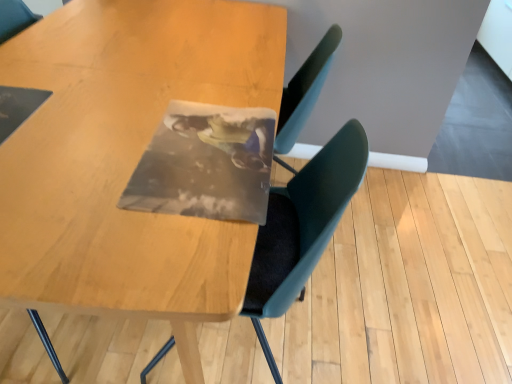
Question: Considering the positions of matte plastic photo frame at center and wooden table at center in the image, is matte plastic photo frame at center bigger or smaller than wooden table at center?

Choices:
 (A) small
 (B) big

Answer: (A)

Question: Do you think matte plastic photo frame at center is within wooden table at center, or outside of it?

Choices:
 (A) outside
 (B) inside

Answer: (B)

Question: Would you say matte plastic photo frame at center is to the left or to the right of wooden table at center in the picture?

Choices:
 (A) left
 (B) right

Answer: (B)

Question: Considering the positions of wooden table at center and matte plastic photo frame at center in the image, is wooden table at center bigger or smaller than matte plastic photo frame at center?

Choices:
 (A) small
 (B) big

Answer: (B)

Question: Relative to matte plastic photo frame at center, is wooden table at center in front or behind?

Choices:
 (A) behind
 (B) front

Answer: (B)

Question: Is point (136, 296) closer or farther from the camera than point (272, 198)?

Choices:
 (A) farther
 (B) closer

Answer: (B)

Question: Considering the positions of wooden table at center and matte plastic photo frame at center in the image, is wooden table at center wider or thinner than matte plastic photo frame at center?

Choices:
 (A) thin
 (B) wide

Answer: (B)